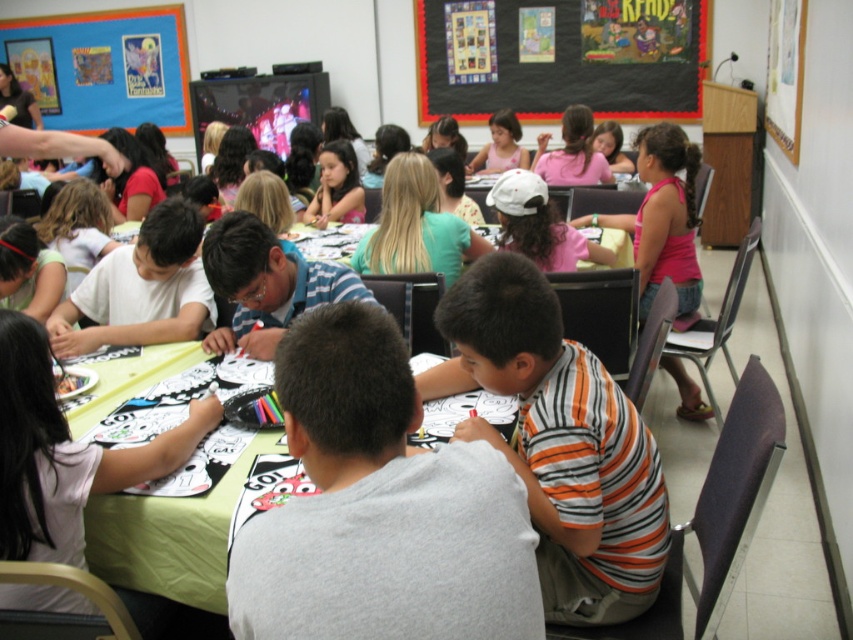
You are a teacher observing the classroom. You notice the green fabric table at center and the matte pink shirt at center. Which object is located closer to the front of the classroom?

The green fabric table at center is positioned under the matte pink shirt at center, meaning the matte pink shirt at center is closer to the front of the classroom.

You are a student in the classroom looking at the black matte bulletin board at upper center and the pink fabric shirt at center. Which object is taller?

The black matte bulletin board at upper center is taller than the pink fabric shirt at center.

You are a teacher in the classroom. You need to place a new poster that is 1 meter wide on the green fabric table at center. The poster is as wide as the matte pink shirt at center. Will the poster fit on the table?

The green fabric table at center is thinner than the matte pink shirt at center. Since the poster is as wide as the matte pink shirt at center, the poster will be wider than the table. Therefore, the poster will not fit on the green fabric table at center.